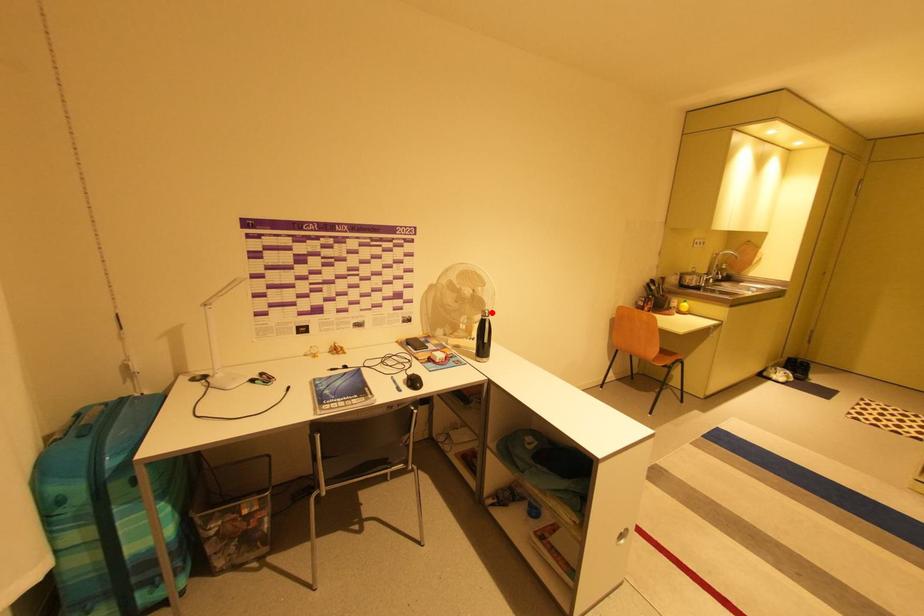
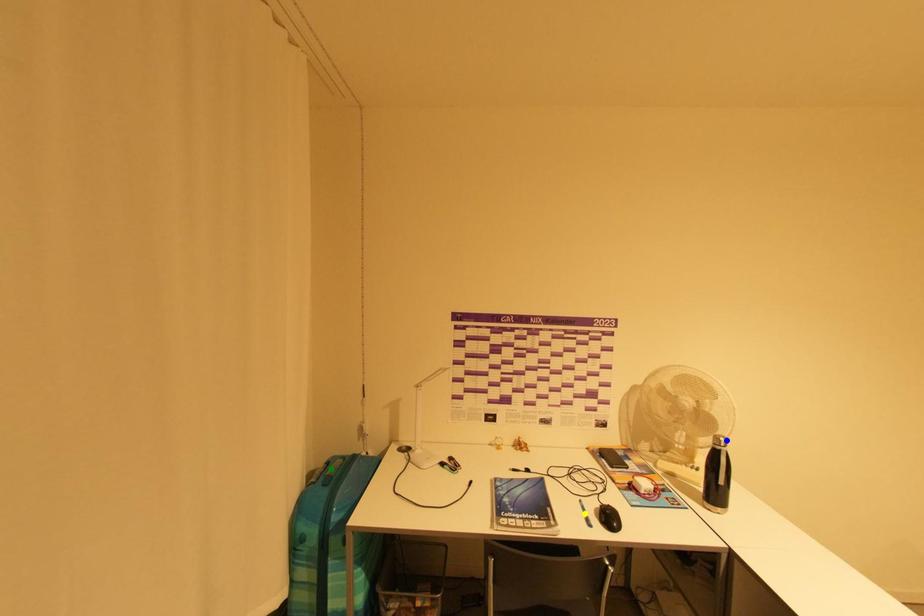
Question: I am providing you with two images of the same scene from different viewpoints. A red point is marked on the first image. You are given multiple points on the second image. Which point in image 2 represents the same 3d spot as the red point in image 1?

Choices:
 (A) green point
 (B) yellow point
 (C) blue point

Answer: (C)